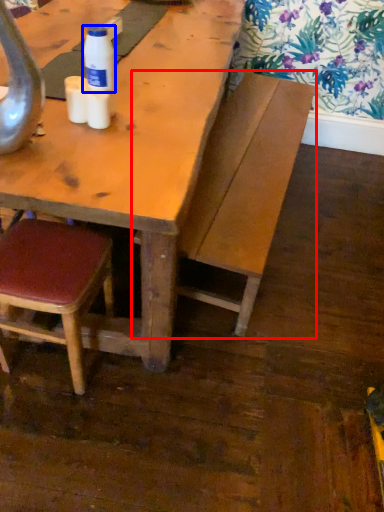
Question: Which of the following is the farthest to the observer, bench (highlighted by a red box) or bottle (highlighted by a blue box)?

Choices:
 (A) bench
 (B) bottle

Answer: (A)